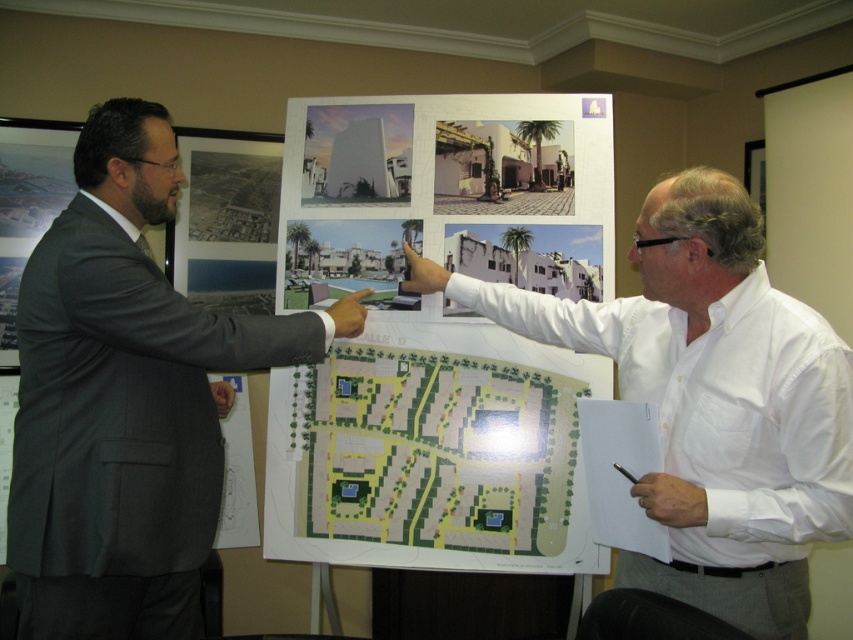
Question: Is white shirt at upper right above green paper map at center?

Choices:
 (A) yes
 (B) no

Answer: (A)

Question: In this image, where is dark gray suit at left located relative to green paper map at center?

Choices:
 (A) left
 (B) right

Answer: (A)

Question: Which point appears closest to the camera in this image?

Choices:
 (A) (492, 492)
 (B) (744, 436)

Answer: (B)

Question: Which point is closer to the camera taking this photo?

Choices:
 (A) (57, 276)
 (B) (795, 387)

Answer: (B)

Question: Which object appears closest to the camera in this image?

Choices:
 (A) white shirt at upper right
 (B) dark gray suit at left
 (C) green paper map at center

Answer: (A)

Question: Does dark gray suit at left have a lesser width compared to green paper map at center?

Choices:
 (A) yes
 (B) no

Answer: (A)